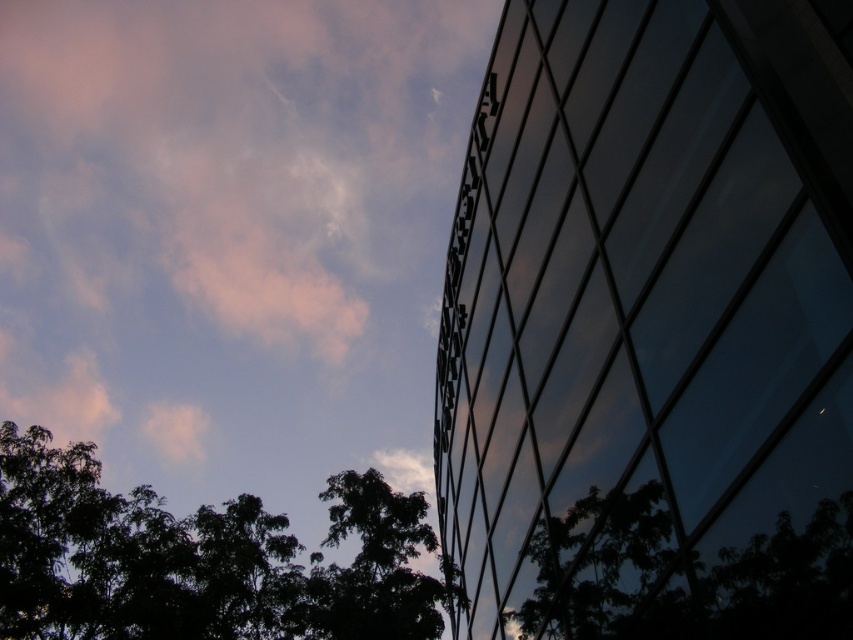
Question: Among these objects, which one is nearest to the camera?

Choices:
 (A) dark green leafy tree at lower right
 (B) pink cloud at upper left
 (C) transparent glass window at upper right
 (D) dark green leafy tree at lower left

Answer: (C)

Question: Where is pink cloud at upper left located in relation to dark green leafy tree at lower left in the image?

Choices:
 (A) above
 (B) below

Answer: (A)

Question: Does transparent glass window at upper right appear on the left side of dark green leafy tree at lower left?

Choices:
 (A) yes
 (B) no

Answer: (B)

Question: Is transparent glass window at upper right above dark green leafy tree at lower left?

Choices:
 (A) no
 (B) yes

Answer: (B)

Question: Which of the following is the farthest from the observer?

Choices:
 (A) transparent glass window at upper right
 (B) dark green leafy tree at lower left

Answer: (B)

Question: Which point is farther to the camera?

Choices:
 (A) (612, 612)
 (B) (654, 26)
 (C) (53, 132)
 (D) (193, 624)

Answer: (C)